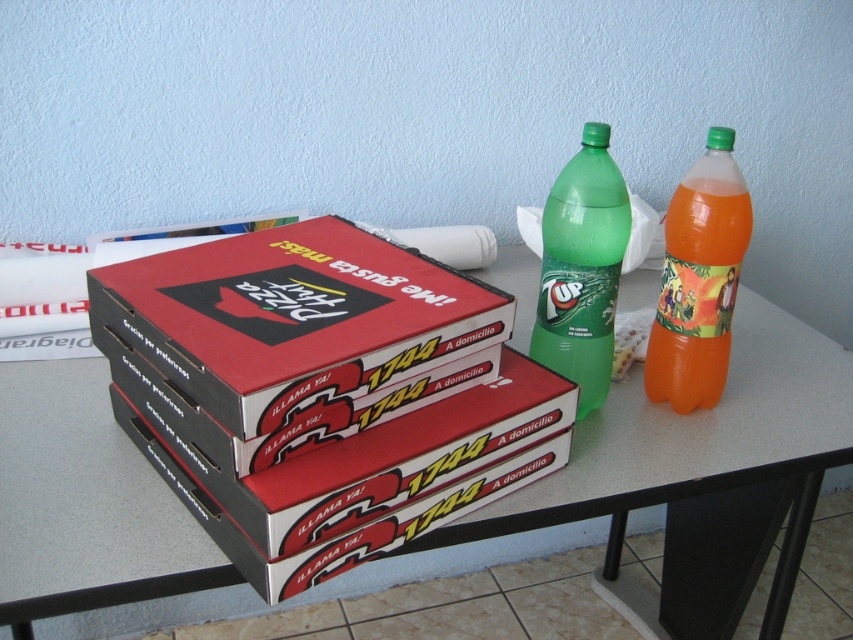
Question: Which point is closer to the camera?

Choices:
 (A) (672, 252)
 (B) (315, 227)
 (C) (587, 458)

Answer: (C)

Question: Can you confirm if translucent orange bottle at right is wider than green matte plastic bottle at upper right?

Choices:
 (A) yes
 (B) no

Answer: (B)

Question: In this image, where is white glossy table at center located relative to matte cardboard pizza box at center?

Choices:
 (A) below
 (B) above

Answer: (A)

Question: Which object is the closest to the translucent orange bottle at right?

Choices:
 (A) white glossy table at center
 (B) green matte plastic bottle at upper right
 (C) matte cardboard pizza box at center

Answer: (B)

Question: Does white glossy table at center appear on the right side of matte cardboard pizza box at center?

Choices:
 (A) no
 (B) yes

Answer: (B)

Question: Which object is closer to the camera taking this photo?

Choices:
 (A) matte cardboard pizza box at center
 (B) translucent orange bottle at right
 (C) white glossy table at center

Answer: (A)